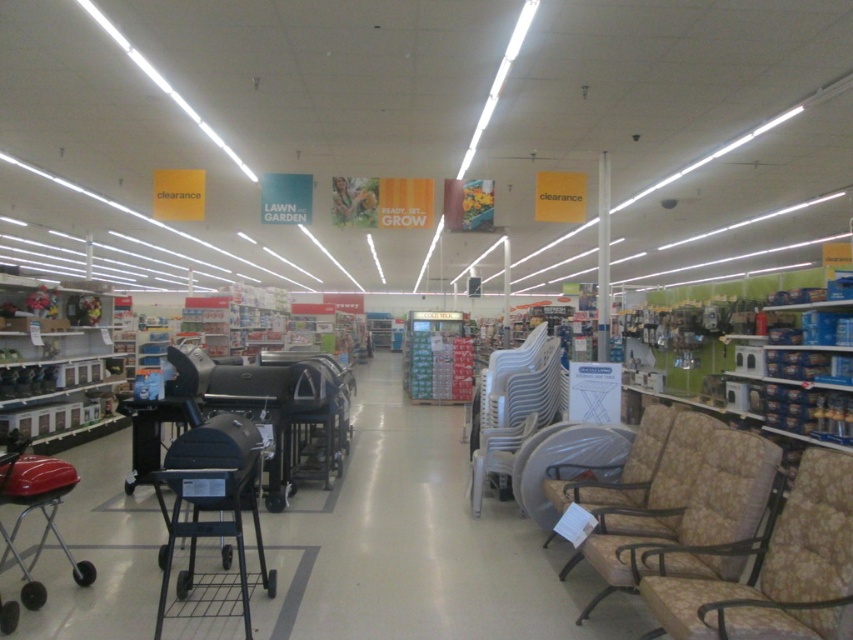
Is point (79, 564) behind point (480, 449)?

No, (79, 564) is in front of (480, 449).

Describe the element at coordinates (36, 508) in the screenshot. I see `red plastic baby carriage at lower left` at that location.

This screenshot has height=640, width=853. Identify the location of red plastic baby carriage at lower left. (36, 508).

Between floral fabric armchair at lower right and beige fabric armchair at center, which one has more height?

beige fabric armchair at center

Is floral fabric armchair at lower right wider than beige fabric armchair at center?

Yes.

This screenshot has height=640, width=853. Identify the location of floral fabric armchair at lower right. (776, 570).

Measure the distance from black matte grill at center-left to red plastic baby carriage at lower left.

They are 32.11 inches apart.

Does black matte grill at center-left appear on the right side of red plastic baby carriage at lower left?

Indeed, black matte grill at center-left is positioned on the right side of red plastic baby carriage at lower left.

Between point (225, 451) and point (61, 486), which one is positioned behind?

The point (61, 486) is more distant.

Locate an element on the screen. This screenshot has width=853, height=640. black matte grill at center-left is located at coordinates (212, 509).